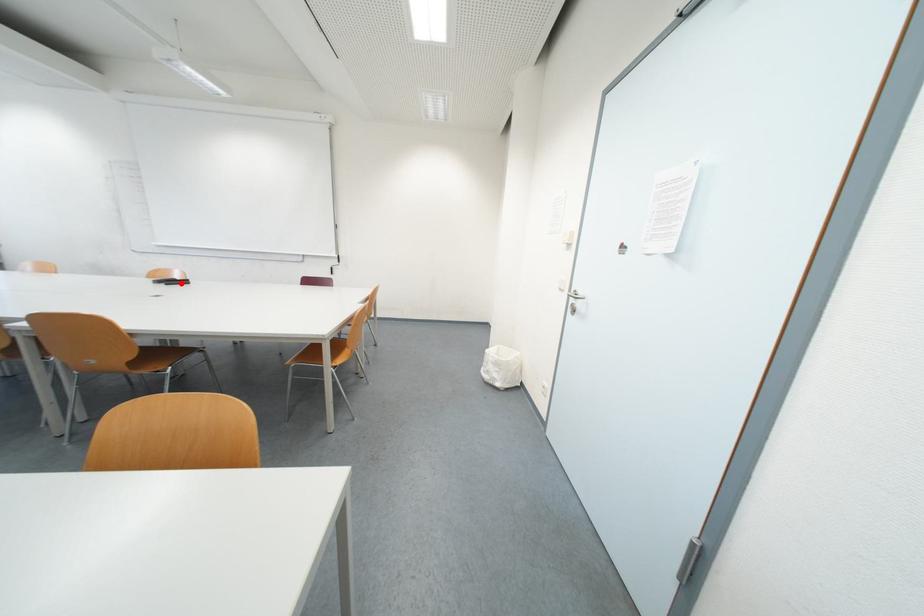
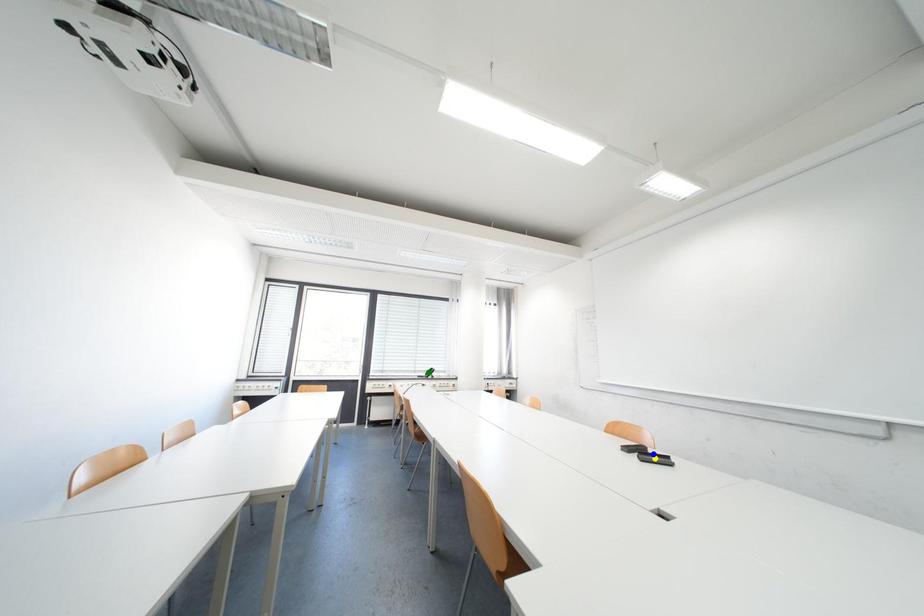
Question: I am providing you with two images of the same scene from different viewpoints. A red point is marked on the first image. You are given multiple points on the second image. In image 2, which mark is for the same physical point as the one in image 1?

Choices:
 (A) yellow point
 (B) green point
 (C) blue point

Answer: (C)